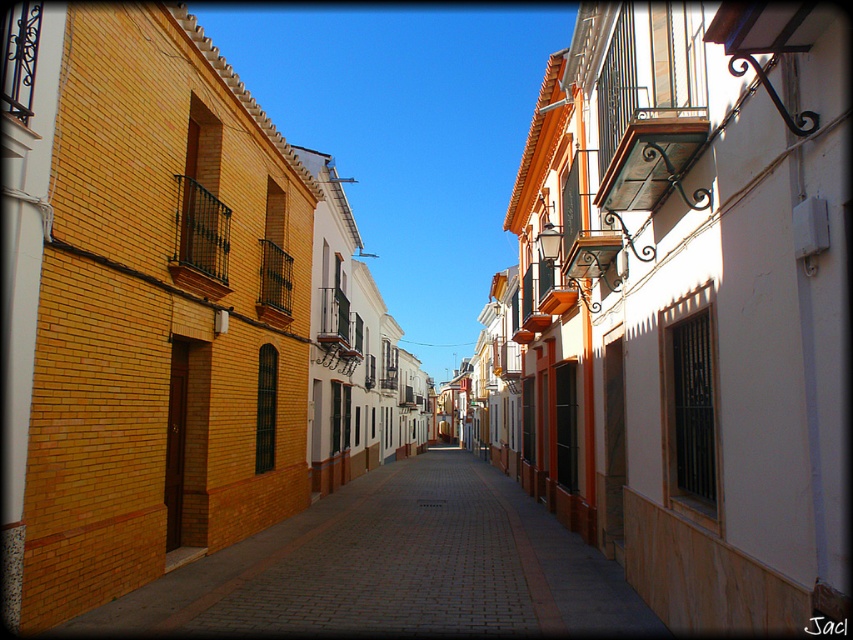
Question: Which point appears farthest from the camera in this image?

Choices:
 (A) (816, 563)
 (B) (146, 604)

Answer: (B)

Question: Does white textured wall at center have a lesser width compared to brick pavement at center?

Choices:
 (A) yes
 (B) no

Answer: (A)

Question: Can you confirm if white textured wall at center is positioned below brick pavement at center?

Choices:
 (A) yes
 (B) no

Answer: (B)

Question: Does white textured wall at center appear under brick pavement at center?

Choices:
 (A) yes
 (B) no

Answer: (B)